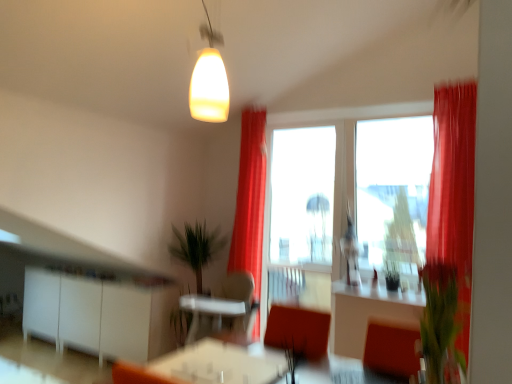
Question: From the image's perspective, would you say silky red curtain at right, which ranks as the second curtain in left-to-right order, is shown under matte glass pendant at upper center?

Choices:
 (A) yes
 (B) no

Answer: (A)

Question: From the image's perspective, does silky red curtain at right, which appears as the second curtain when viewed from the back, appear higher than matte glass pendant at upper center?

Choices:
 (A) yes
 (B) no

Answer: (B)

Question: From a real-world perspective, is silky red curtain at right, positioned as the first curtain in front-to-back order, below matte glass pendant at upper center?

Choices:
 (A) yes
 (B) no

Answer: (A)

Question: Is silky red curtain at right, the first curtain positioned from the right, positioned in front of matte glass pendant at upper center?

Choices:
 (A) yes
 (B) no

Answer: (B)

Question: Is silky red curtain at right, which appears as the second curtain when viewed from the back, shorter than matte glass pendant at upper center?

Choices:
 (A) yes
 (B) no

Answer: (B)

Question: From a real-world perspective, is green matte plant at center, the 2th plant in the front-to-back sequence, above or below matte glass pendant at upper center?

Choices:
 (A) above
 (B) below

Answer: (B)

Question: Considering the positions of green matte plant at center, the first plant positioned from the back, and matte glass pendant at upper center in the image, is green matte plant at center, the first plant positioned from the back, bigger or smaller than matte glass pendant at upper center?

Choices:
 (A) small
 (B) big

Answer: (A)

Question: In terms of height, does green matte plant at center, the first plant positioned from the back, look taller or shorter compared to matte glass pendant at upper center?

Choices:
 (A) tall
 (B) short

Answer: (B)

Question: Considering the relative positions of green matte plant at center, the first plant positioned from the back, and matte glass pendant at upper center in the image provided, is green matte plant at center, the first plant positioned from the back, to the left or to the right of matte glass pendant at upper center?

Choices:
 (A) left
 (B) right

Answer: (B)

Question: Would you say transparent glass window at center, the second window screen viewed from the right, is inside or outside green matte plant at center, marked as the 1th plant in a left-to-right arrangement?

Choices:
 (A) inside
 (B) outside

Answer: (B)

Question: In terms of height, does transparent glass window at center, which appears as the 2th window screen when viewed from the front, look taller or shorter compared to green matte plant at center, which is the second plant in right-to-left order?

Choices:
 (A) tall
 (B) short

Answer: (A)

Question: From the image's perspective, is transparent glass window at center, the second window screen viewed from the right, located above or below green matte plant at center, the 2th plant viewed from the top?

Choices:
 (A) above
 (B) below

Answer: (A)

Question: From a real-world perspective, is transparent glass window at center, the second window screen viewed from the right, above or below green matte plant at center, the 2th plant viewed from the top?

Choices:
 (A) above
 (B) below

Answer: (A)

Question: In terms of width, does transparent glass window at center, which appears as the 2th window screen when viewed from the front, look wider or thinner when compared to silky red curtain at center, the second curtain when ordered from front to back?

Choices:
 (A) thin
 (B) wide

Answer: (A)

Question: In the image, is transparent glass window at center, the second window screen viewed from the right, positioned in front of or behind silky red curtain at center, the 2th curtain in the right-to-left sequence?

Choices:
 (A) front
 (B) behind

Answer: (B)